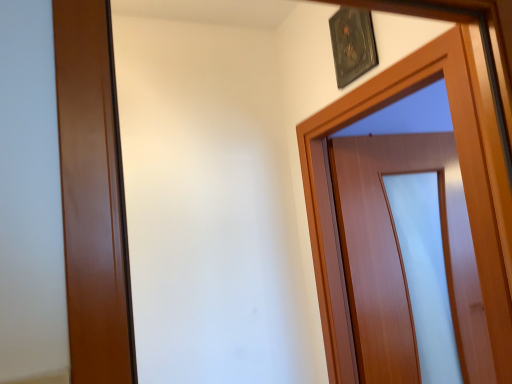
Question: Is metallic plaque at upper center wider than wooden door at upper right?

Choices:
 (A) no
 (B) yes

Answer: (A)

Question: Is metallic plaque at upper center positioned with its back to wooden door at upper right?

Choices:
 (A) no
 (B) yes

Answer: (A)

Question: Would you say metallic plaque at upper center is a long distance from wooden door at upper right?

Choices:
 (A) yes
 (B) no

Answer: (B)

Question: Is metallic plaque at upper center outside wooden door at upper right?

Choices:
 (A) no
 (B) yes

Answer: (B)

Question: Can you confirm if metallic plaque at upper center is taller than wooden door at upper right?

Choices:
 (A) yes
 (B) no

Answer: (B)

Question: From a real-world perspective, is metallic plaque at upper center physically below wooden door at upper right?

Choices:
 (A) no
 (B) yes

Answer: (A)

Question: Is wooden door at upper right further to the viewer compared to metallic plaque at upper center?

Choices:
 (A) no
 (B) yes

Answer: (A)

Question: Could you tell me if wooden door at upper right is turned towards metallic plaque at upper center?

Choices:
 (A) no
 (B) yes

Answer: (A)

Question: Is wooden door at upper right at the left side of metallic plaque at upper center?

Choices:
 (A) no
 (B) yes

Answer: (A)

Question: From the image's perspective, does wooden door at upper right appear lower than metallic plaque at upper center?

Choices:
 (A) no
 (B) yes

Answer: (B)

Question: Would you say metallic plaque at upper center is part of wooden door at upper right's contents?

Choices:
 (A) no
 (B) yes

Answer: (A)

Question: Is wooden door at upper right next to metallic plaque at upper center?

Choices:
 (A) no
 (B) yes

Answer: (A)

Question: In terms of size, does wooden door at upper right appear bigger or smaller than metallic plaque at upper center?

Choices:
 (A) big
 (B) small

Answer: (A)